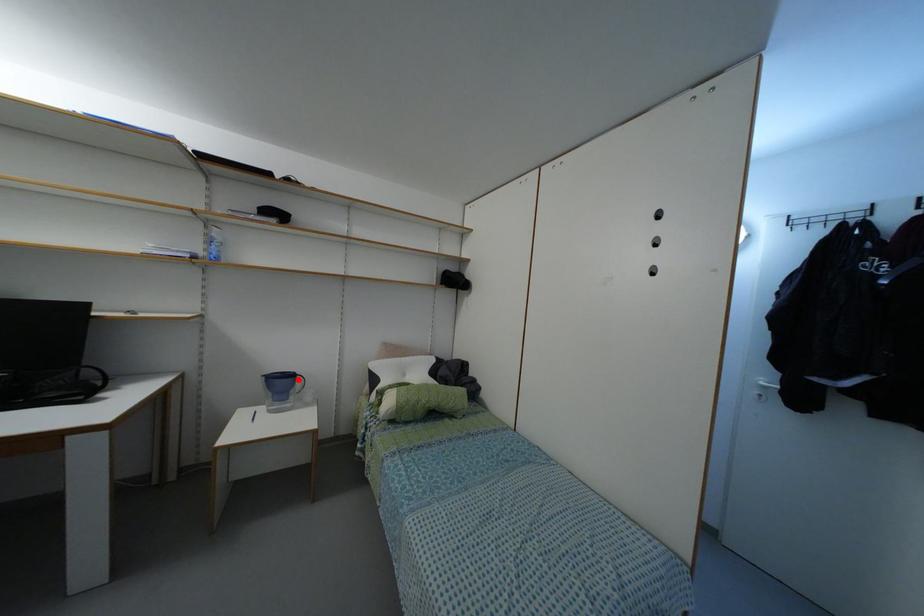
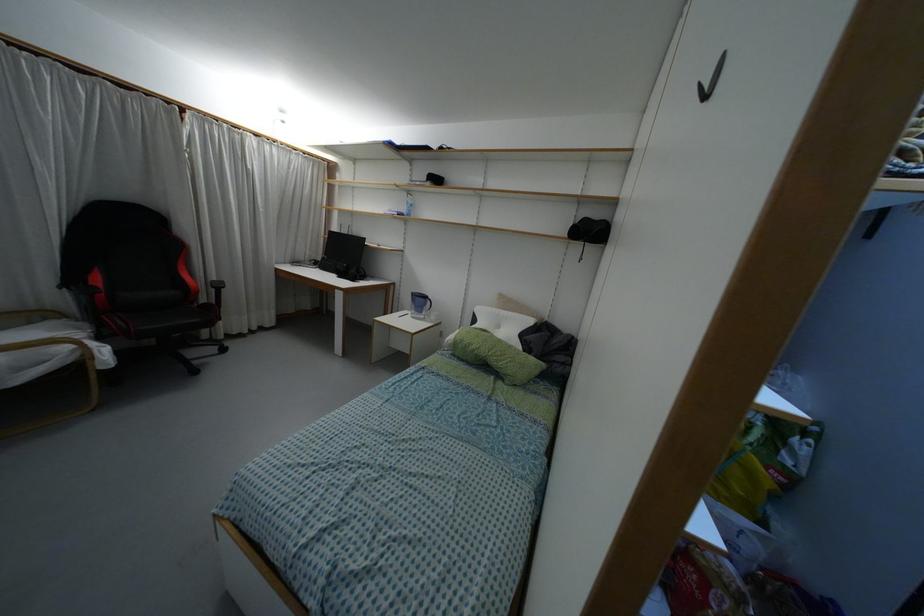
Locate, in the second image, the point that corresponds to the highlighted location in the first image.

(428, 302)